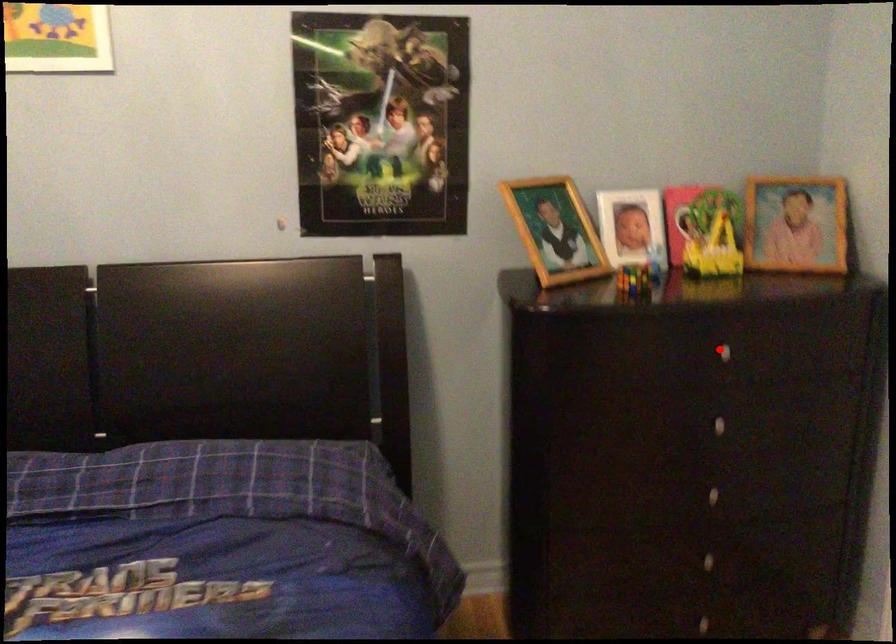
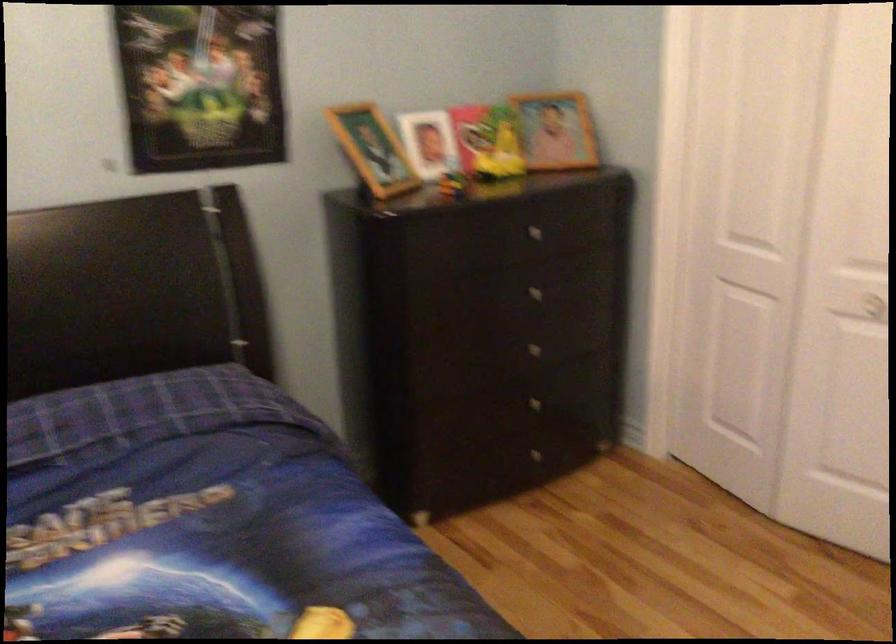
In the second image, find the point that corresponds to the highlighted location in the first image.

(530, 230)